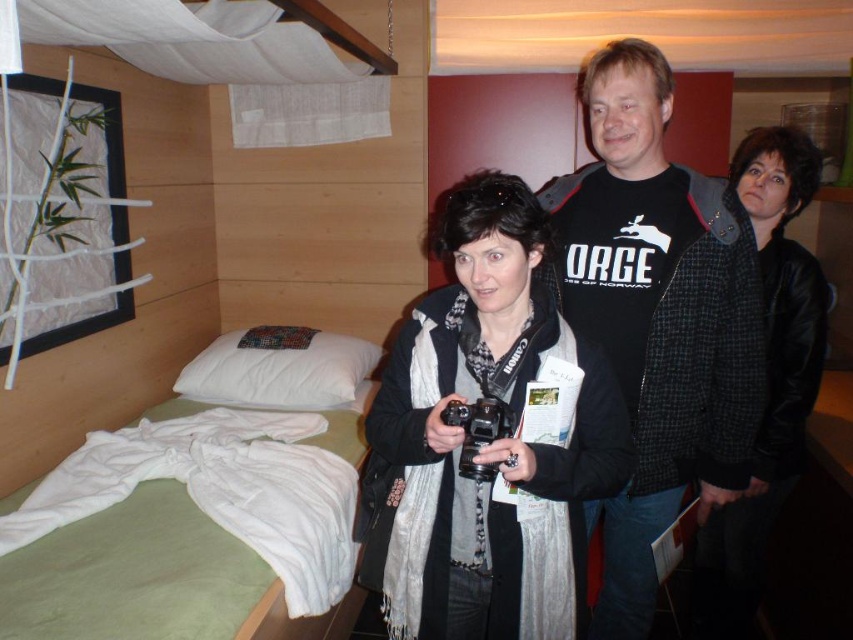
Which of these two, white fabric bed at lower left or black plastic camera at center, stands shorter?

black plastic camera at center is shorter.

Between white fabric bed at lower left and black plastic camera at center, which one is positioned higher?

black plastic camera at center is above.

Which is in front, point (105, 604) or point (479, 429)?

Point (479, 429) is in front.

The width and height of the screenshot is (853, 640). I want to click on white fabric bed at lower left, so click(183, 528).

Between point (630, 160) and point (805, 147), which one is positioned behind?

The point (805, 147) is more distant.

From the picture: Does black cotton t-shirt at center come behind black leather jacket at center?

No, black cotton t-shirt at center is closer to the viewer.

Which is behind, point (679, 420) or point (791, 346)?

Positioned behind is point (791, 346).

The width and height of the screenshot is (853, 640). I want to click on black cotton t-shirt at center, so click(x=656, y=316).

Who is higher up, black woolen scarf at center or black plastic camera at center?

Positioned higher is black plastic camera at center.

Between point (461, 310) and point (460, 460), which one is positioned in front?

Point (460, 460) is in front.

Is point (534, 298) positioned in front of point (469, 465)?

No, it is not.

The image size is (853, 640). Find the location of `black woolen scarf at center`. black woolen scarf at center is located at coordinates (486, 442).